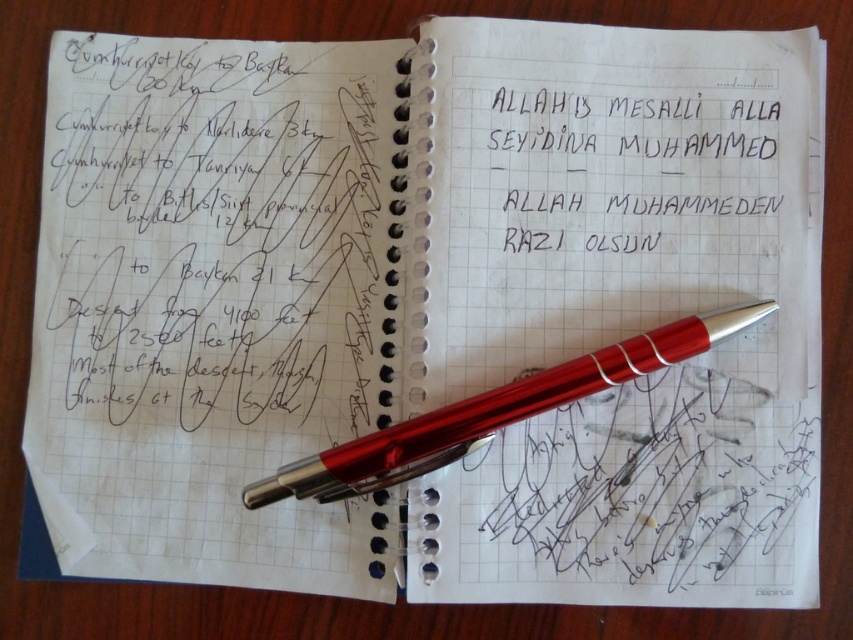
Can you confirm if black handwritten text at upper right is positioned below metallic red pen at center?

Actually, black handwritten text at upper right is above metallic red pen at center.

From the picture: Is black handwritten text at upper right positioned at the back of metallic red pen at center?

That is True.

Which is behind, point (694, 173) or point (561, 394)?

Point (694, 173)

The height and width of the screenshot is (640, 853). Identify the location of black handwritten text at upper right. (631, 168).